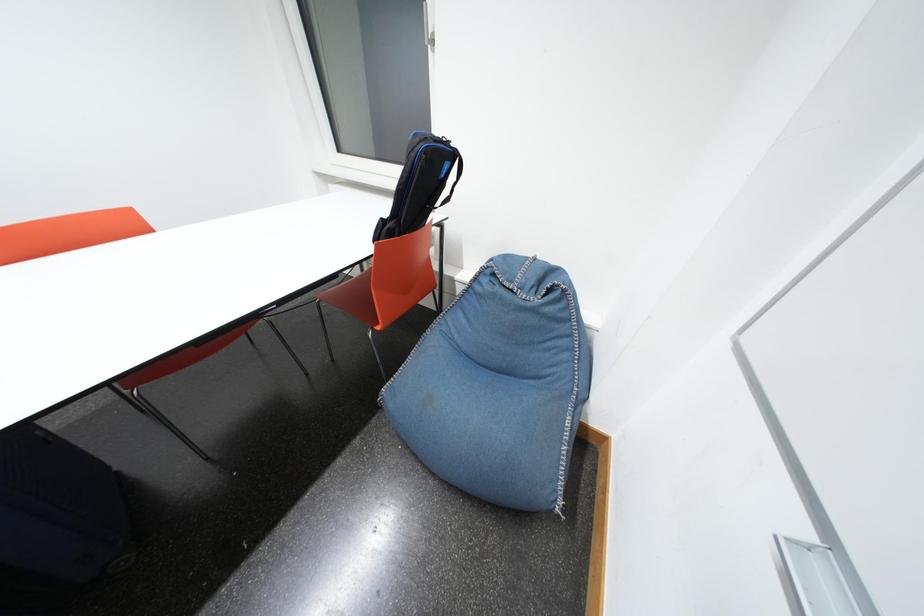
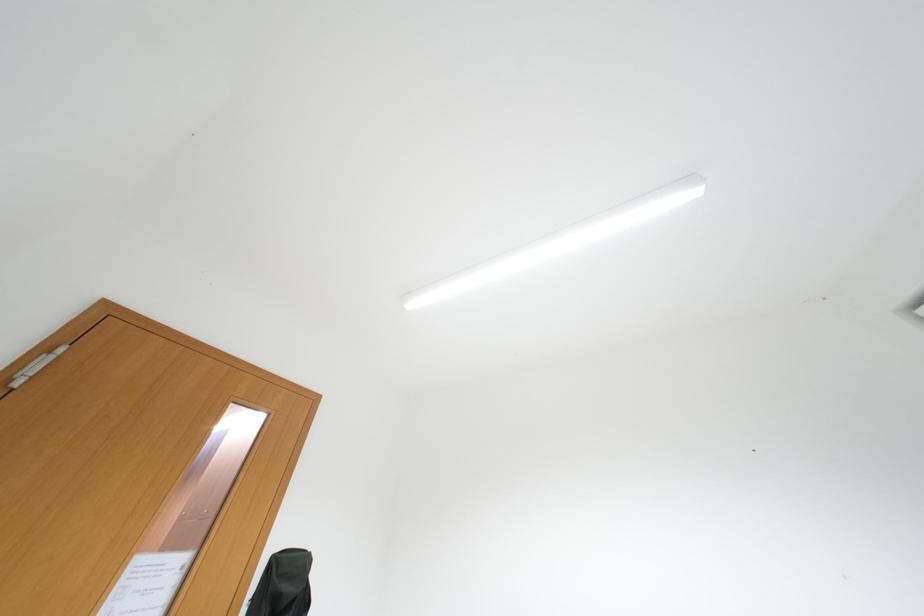
The first image is from the beginning of the video and the second image is from the end. How did the camera likely rotate when shooting the video?

The camera's rotation is toward left-up.